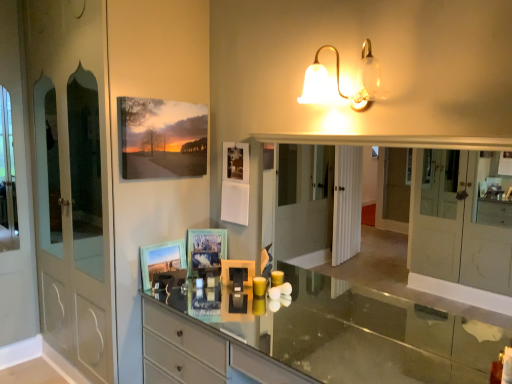
Identify the location of vacant space underneath translucent glass sconce at upper center (from a real-world perspective). (330, 334).